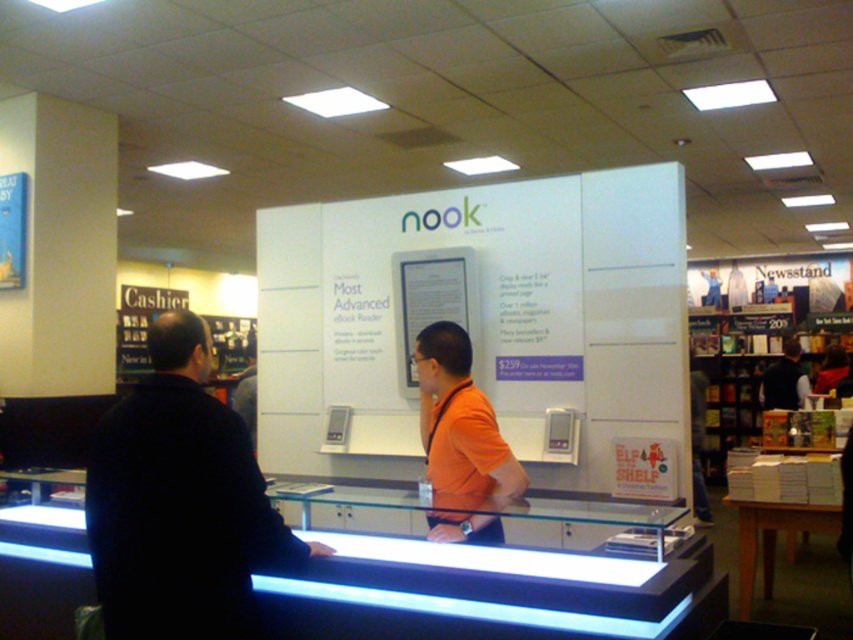
Is point (717, 579) closer to viewer compared to point (434, 362)?

That is True.

Between transparent glass counter at center and orange fabric shirt at center, which one is positioned higher?

orange fabric shirt at center

Who is more forward, [532,628] or [488,492]?

Point [532,628] is in front.

Locate an element on the screen. The width and height of the screenshot is (853, 640). transparent glass counter at center is located at coordinates (488, 593).

Which of these two, dark blue jacket at left or orange fabric shirt at center, stands taller?

Standing taller between the two is dark blue jacket at left.

Does dark blue jacket at left appear on the right side of orange fabric shirt at center?

Incorrect, dark blue jacket at left is not on the right side of orange fabric shirt at center.

In order to click on dark blue jacket at left in this screenshot , I will do `click(180, 502)`.

Based on the photo, measure the distance between dark blue jacket at left and dark blue vest at center.

A distance of 7.03 meters exists between dark blue jacket at left and dark blue vest at center.

The image size is (853, 640). What are the coordinates of `dark blue jacket at left` in the screenshot? It's located at (180, 502).